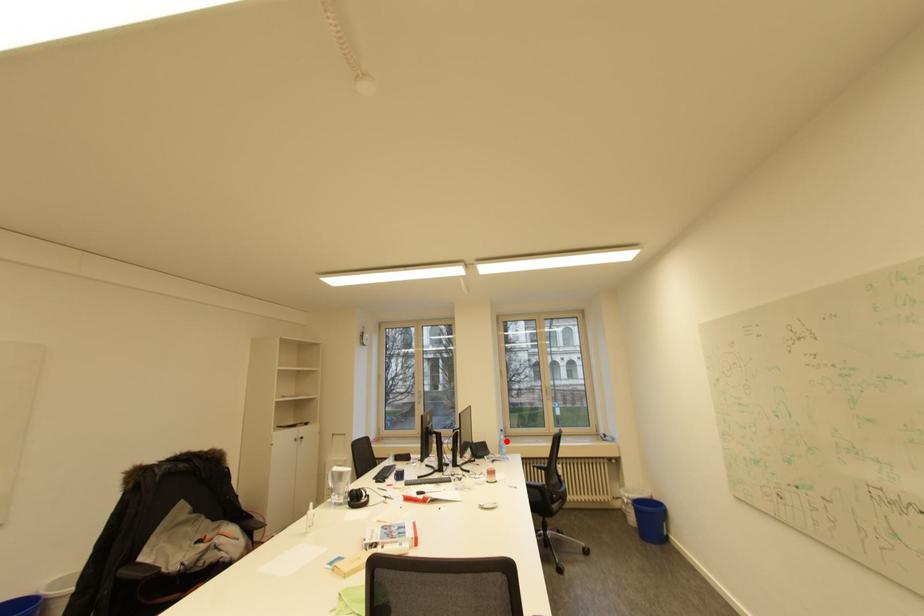
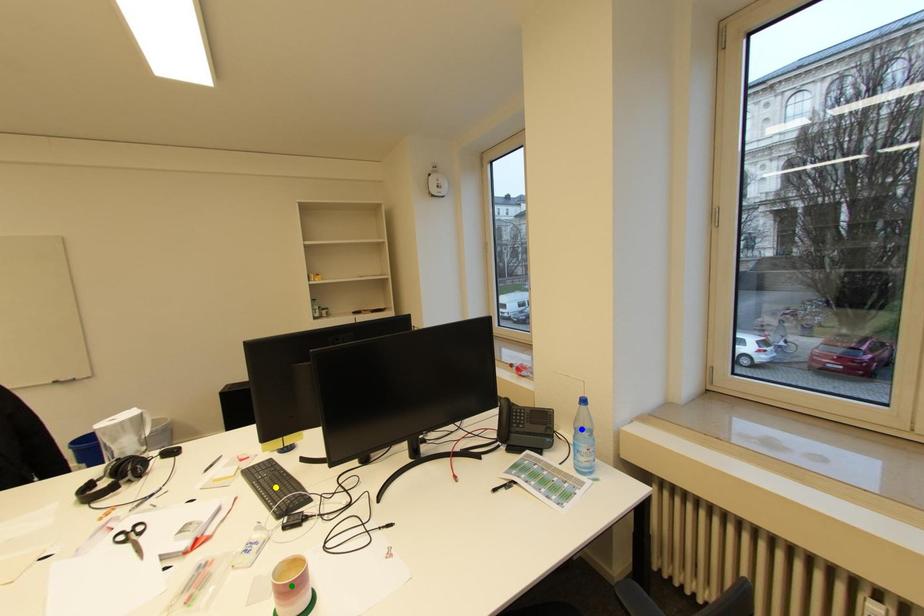
Question: I am providing you with two images of the same scene from different viewpoints. A red point is marked on the first image. You are given multiple points on the second image. Which spot in image 2 lines up with the point in image 1?

Choices:
 (A) yellow point
 (B) blue point
 (C) green point

Answer: (B)